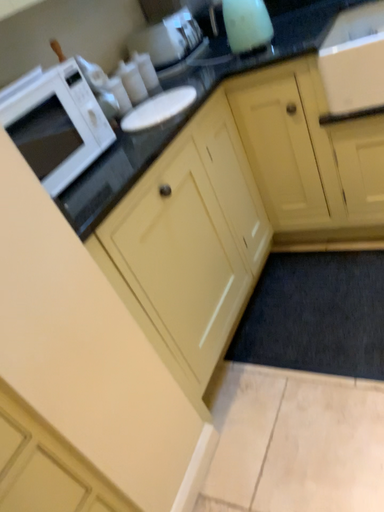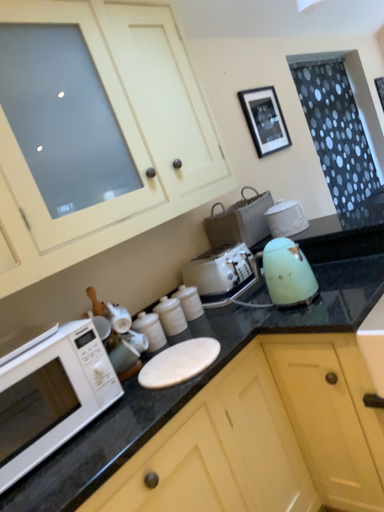
Question: Which way did the camera rotate in the video?

Choices:
 (A) rotated right
 (B) rotated left

Answer: (B)